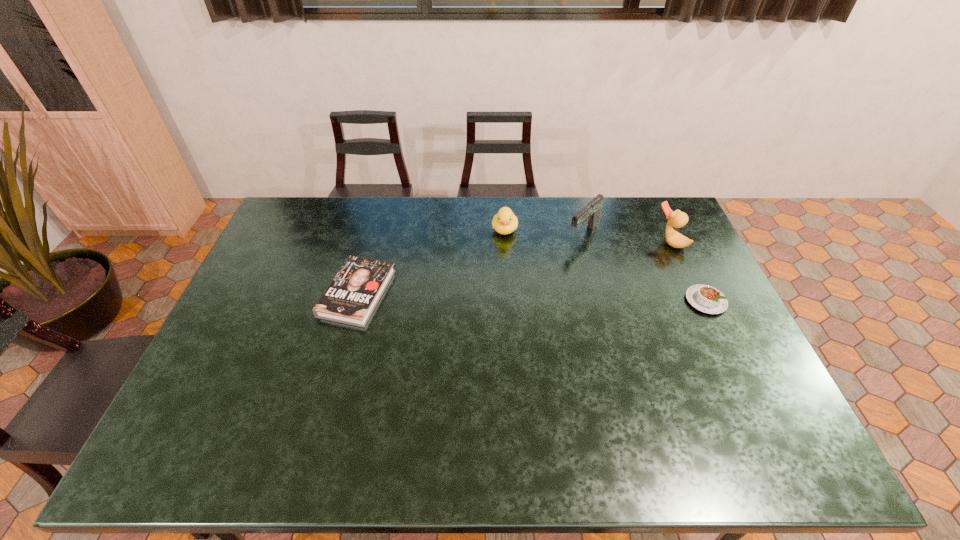
At what (x,y) coordinates should I click in order to perform the action: click on the shortest object. Please return your answer as a coordinate pair (x, y). The width and height of the screenshot is (960, 540). Looking at the image, I should click on (353, 294).

Identify the location of book. The image size is (960, 540). (353, 294).

The image size is (960, 540). In order to click on pudding in this screenshot , I will do `click(707, 299)`.

Identify the location of duck. The image size is (960, 540). (677, 219).

Where is `the third object from right to left`? The image size is (960, 540). the third object from right to left is located at coordinates (591, 212).

Where is `the second object from left to right`? The width and height of the screenshot is (960, 540). the second object from left to right is located at coordinates (504, 222).

Find the location of a particular element. duckling is located at coordinates (504, 222).

You are a GUI agent. You are given a task and a screenshot of the screen. Output one action in this format:
    pyautogui.click(x=<x>, y=<y>)
    Task: Click on the free point located 0.050m on the front of the book
    
    Given the screenshot: What is the action you would take?
    pyautogui.click(x=345, y=342)

Find the location of a particular element. The height and width of the screenshot is (540, 960). vacant area situated on the front of the pudding is located at coordinates (758, 410).

I want to click on free space located on the beak of the duck, so click(x=614, y=276).